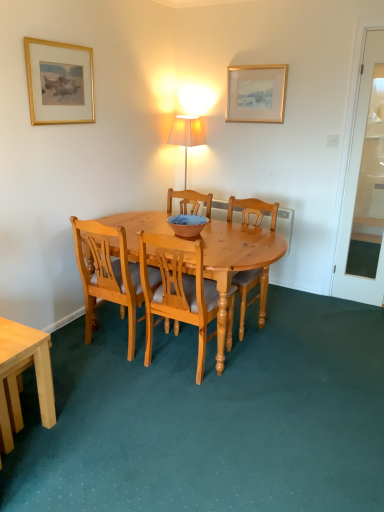
Question: Does light brown wooden chair at center, positioned as the 1th chair in right-to-left order, have a smaller size compared to light brown wooden desk at lower left?

Choices:
 (A) no
 (B) yes

Answer: (A)

Question: Is light brown wooden chair at center, positioned as the 1th chair in right-to-left order, not close to light brown wooden desk at lower left?

Choices:
 (A) yes
 (B) no

Answer: (A)

Question: Considering the relative positions of light brown wooden chair at center, arranged as the third chair when viewed from the left, and light brown wooden desk at lower left in the image provided, is light brown wooden chair at center, arranged as the third chair when viewed from the left, to the left of light brown wooden desk at lower left from the viewer's perspective?

Choices:
 (A) no
 (B) yes

Answer: (A)

Question: From a real-world perspective, is light brown wooden chair at center, arranged as the third chair when viewed from the left, located beneath light brown wooden desk at lower left?

Choices:
 (A) no
 (B) yes

Answer: (A)

Question: Is light brown wooden chair at center, arranged as the third chair when viewed from the left, surrounding light brown wooden desk at lower left?

Choices:
 (A) no
 (B) yes

Answer: (A)

Question: In the image, is light brown wood chair at center, which is counted as the 1th chair, starting from the left, positioned in front of or behind light brown wooden desk at lower left?

Choices:
 (A) behind
 (B) front

Answer: (A)

Question: Looking at their shapes, would you say light brown wood chair at center, which is counted as the 1th chair, starting from the left, is wider or thinner than light brown wooden desk at lower left?

Choices:
 (A) thin
 (B) wide

Answer: (B)

Question: From a real-world perspective, is light brown wood chair at center, which is counted as the 1th chair, starting from the left, positioned above or below light brown wooden desk at lower left?

Choices:
 (A) below
 (B) above

Answer: (B)

Question: Does point (160, 273) appear closer or farther from the camera than point (39, 384)?

Choices:
 (A) farther
 (B) closer

Answer: (A)

Question: Looking at their shapes, would you say blue and white ceramic bowl at center is wider or thinner than light brown wooden chair at center, arranged as the third chair when viewed from the left?

Choices:
 (A) wide
 (B) thin

Answer: (B)

Question: From a real-world perspective, is blue and white ceramic bowl at center above or below light brown wooden chair at center, positioned as the 1th chair in right-to-left order?

Choices:
 (A) above
 (B) below

Answer: (A)

Question: Is blue and white ceramic bowl at center taller or shorter than light brown wooden chair at center, arranged as the third chair when viewed from the left?

Choices:
 (A) tall
 (B) short

Answer: (B)

Question: Is blue and white ceramic bowl at center to the left or to the right of light brown wooden chair at center, arranged as the third chair when viewed from the left, in the image?

Choices:
 (A) right
 (B) left

Answer: (B)

Question: From the image's perspective, is light brown wood chair at center, which is counted as the 1th chair, starting from the left, located above or below light brown wooden chair at center, arranged as the third chair when viewed from the left?

Choices:
 (A) above
 (B) below

Answer: (B)

Question: Would you say light brown wood chair at center, the third chair in the right-to-left sequence, is inside or outside light brown wooden chair at center, arranged as the third chair when viewed from the left?

Choices:
 (A) outside
 (B) inside

Answer: (A)